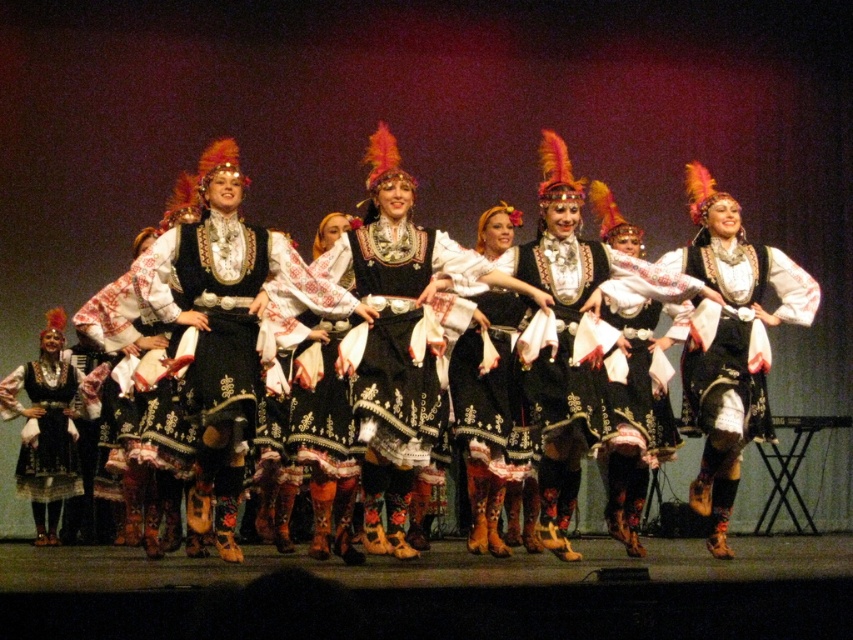
Between point (397, 282) and point (210, 148), which one is positioned in front?

Point (397, 282) is in front.

Is black embroidered dress at center smaller than black satin dress at center?

Indeed, black embroidered dress at center has a smaller size compared to black satin dress at center.

Is point (419, 291) positioned in front of point (680, 280)?

Yes.

Identify the location of black embroidered dress at center. (395, 339).

Between black embroidered dress at center and embroidered velvet dress at center, which one has less height?

Standing shorter between the two is black embroidered dress at center.

Find the location of `black embroidered dress at center`. black embroidered dress at center is located at coordinates (395, 339).

Which is behind, point (410, 362) or point (512, 365)?

The point (512, 365) is behind.

The image size is (853, 640). I want to click on black embroidered dress at center, so click(x=395, y=339).

Is point (369, 424) positioned in front of point (35, 486)?

Yes, it is.

Who is positioned more to the right, black embroidered dress at center or matte black dress at left?

black embroidered dress at center is more to the right.

At what (x,y) coordinates should I click in order to perform the action: click on black embroidered dress at center. Please return your answer as a coordinate pair (x, y). Looking at the image, I should click on (395, 339).